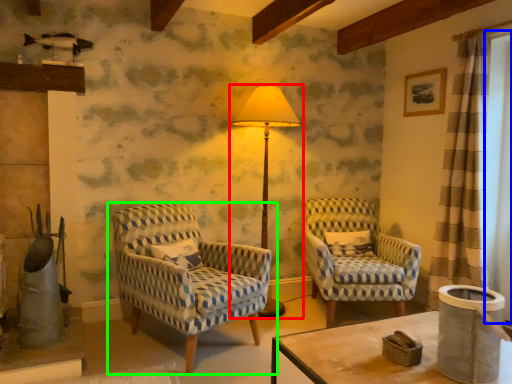
Question: Which object is the closest to the lamp (highlighted by a red box)? Choose among these: window screen (highlighted by a blue box) or chair (highlighted by a green box).

Choices:
 (A) window screen
 (B) chair

Answer: (B)